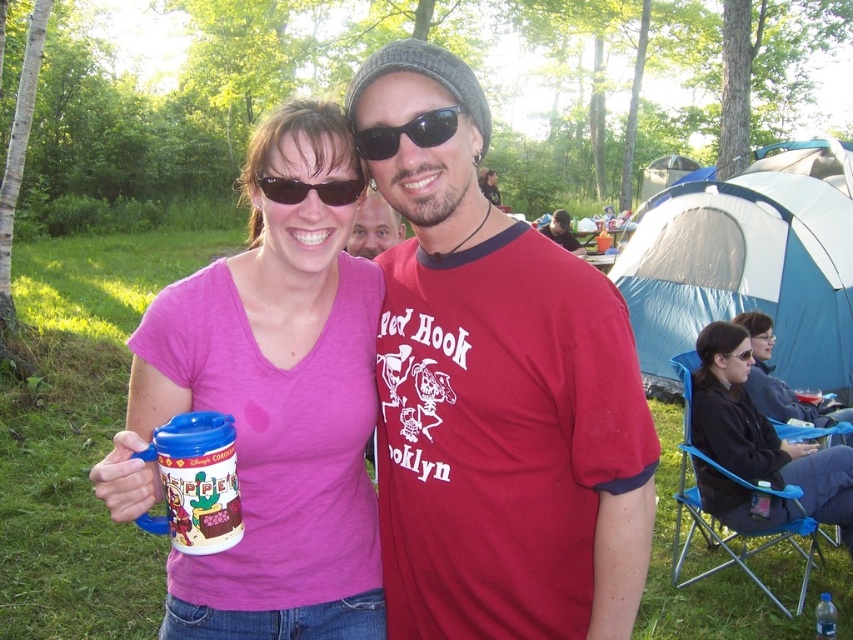
Question: Is matte plastic mug at center above black reflective sunglasses at center?

Choices:
 (A) yes
 (B) no

Answer: (B)

Question: Which point is farther to the camera?

Choices:
 (A) matte pink shirt at center
 (B) translucent plastic cup at upper center
 (C) matte black jacket at lower right
 (D) red cotton t-shirt at center

Answer: (A)

Question: Which object appears farthest from the camera in this image?

Choices:
 (A) red cotton t-shirt at center
 (B) black reflective sunglasses at center

Answer: (B)

Question: Is black fleece jacket at lower right to the right of black plastic sunglasses at upper center from the viewer's perspective?

Choices:
 (A) yes
 (B) no

Answer: (A)

Question: Does red cotton t-shirt at center appear over black fleece jacket at lower right?

Choices:
 (A) yes
 (B) no

Answer: (A)

Question: Based on their relative distances, which object is nearer to the matte black jacket at lower right?

Choices:
 (A) black fleece jacket at lower right
 (B) matte black sunglasses at center
 (C) matte plastic cup at center

Answer: (A)